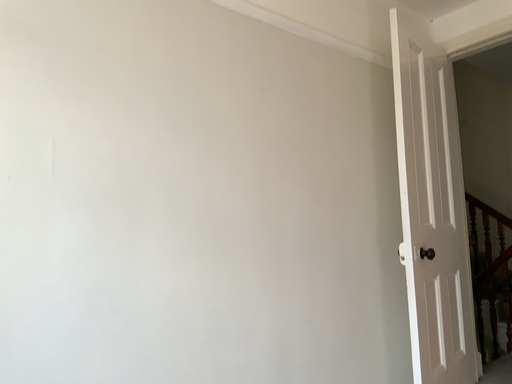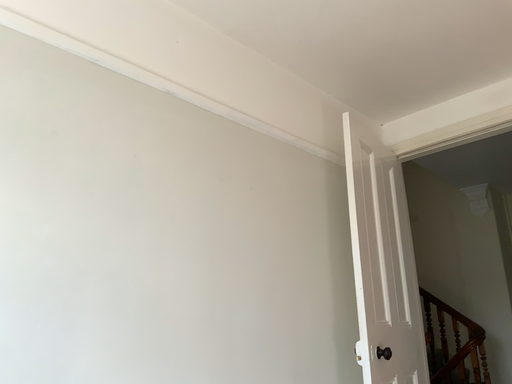
Question: Which way did the camera rotate in the video?

Choices:
 (A) rotated downward
 (B) rotated upward

Answer: (B)